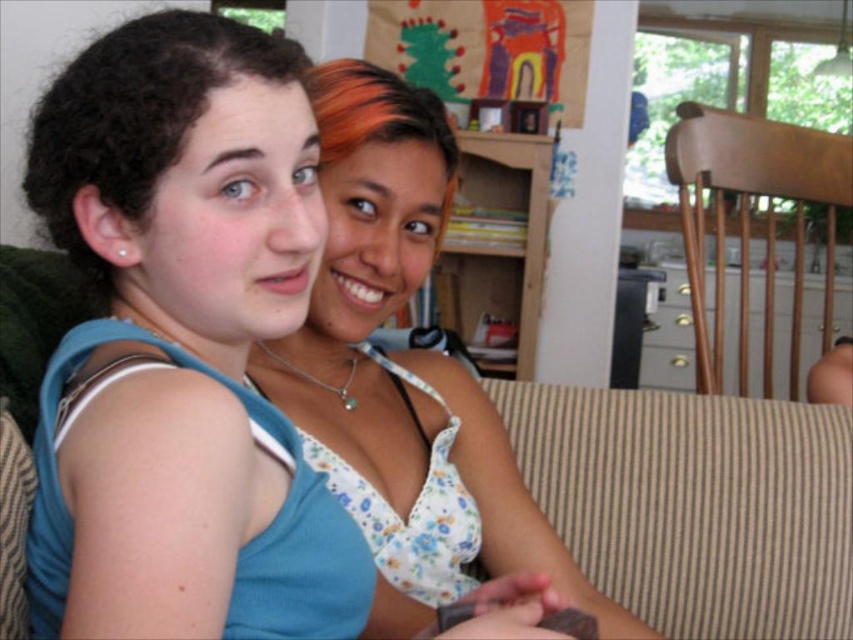
Is blue fabric tank top at center to the left of brown striped fabric at lower right from the viewer's perspective?

Indeed, blue fabric tank top at center is positioned on the left side of brown striped fabric at lower right.

Who is positioned more to the left, blue fabric tank top at center or brown striped fabric at lower right?

From the viewer's perspective, blue fabric tank top at center appears more on the left side.

Who is more forward, (199, 198) or (579, 554)?

Point (199, 198)

Locate an element on the screen. The height and width of the screenshot is (640, 853). blue fabric tank top at center is located at coordinates (183, 346).

Is blue fabric tank top at center taller than floral fabric top at center?

Incorrect, blue fabric tank top at center's height is not larger of floral fabric top at center's.

Can you confirm if blue fabric tank top at center is positioned to the right of floral fabric top at center?

→ No, blue fabric tank top at center is not to the right of floral fabric top at center.

Who is more forward, (x=194, y=346) or (x=439, y=472)?

Point (x=194, y=346)

In order to click on blue fabric tank top at center in this screenshot , I will do `click(183, 346)`.

Which is in front, point (335, 314) or point (689, 412)?

Point (335, 314) is in front.

Is floral fabric top at center above brown striped fabric at lower right?

Yes.

Measure the distance between point (381, 593) and camera.

Point (381, 593) is 33.82 inches away from camera.

At what (x,y) coordinates should I click in order to perform the action: click on floral fabric top at center. Please return your answer as a coordinate pair (x, y). This screenshot has width=853, height=640. Looking at the image, I should click on (404, 372).